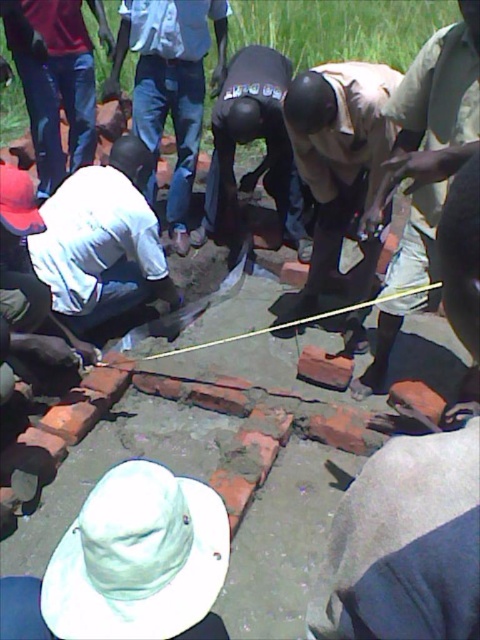
The height and width of the screenshot is (640, 480). I want to click on white matte shirt at lower left, so click(101, 241).

Is white matte shirt at lower left positioned behind dark brown leather gloves at center?

No, white matte shirt at lower left is closer to the viewer.

Between point (84, 240) and point (264, 76), which one is positioned in front?

Point (84, 240) is more forward.

This screenshot has width=480, height=640. I want to click on white matte shirt at lower left, so click(x=101, y=241).

Is brown fabric shirt at center below red clay brick at center?

No, brown fabric shirt at center is not below red clay brick at center.

Can you confirm if brown fabric shirt at center is taller than red clay brick at center?

Indeed, brown fabric shirt at center has a greater height compared to red clay brick at center.

Is point (372, 144) closer to viewer compared to point (326, 372)?

That is True.

The image size is (480, 640). What are the coordinates of `brown fabric shirt at center` in the screenshot? It's located at (337, 152).

What do you see at coordinates (251, 141) in the screenshot? The height and width of the screenshot is (640, 480). I see `dark brown leather gloves at center` at bounding box center [251, 141].

Which is in front, point (259, 77) or point (335, 385)?

Point (335, 385) is in front.

Where is `dark brown leather gloves at center`? The height and width of the screenshot is (640, 480). dark brown leather gloves at center is located at coordinates (251, 141).